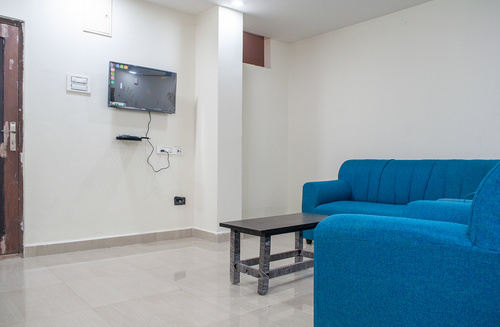
The height and width of the screenshot is (327, 500). What are the coordinates of `couch` in the screenshot? It's located at (385, 181), (443, 187).